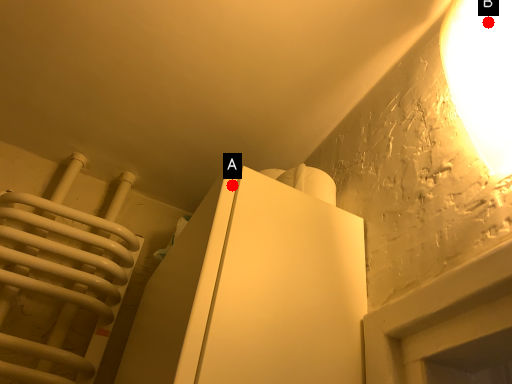
Question: Two points are circled on the image, labeled by A and B beside each circle. Which point is further to the camera?

Choices:
 (A) A is further
 (B) B is further

Answer: (A)